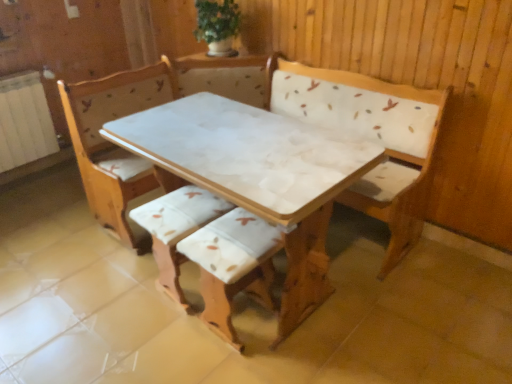
Locate an element on the screen. The height and width of the screenshot is (384, 512). blank area to the left of white marble table at center is located at coordinates (83, 296).